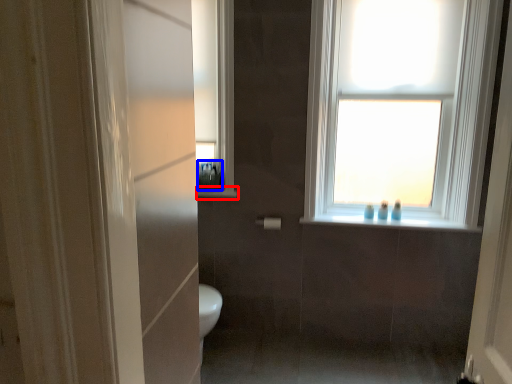
Question: Which of the following is the farthest to the observer, window sill (highlighted by a red box) or toiletry (highlighted by a blue box)?

Choices:
 (A) window sill
 (B) toiletry

Answer: (A)